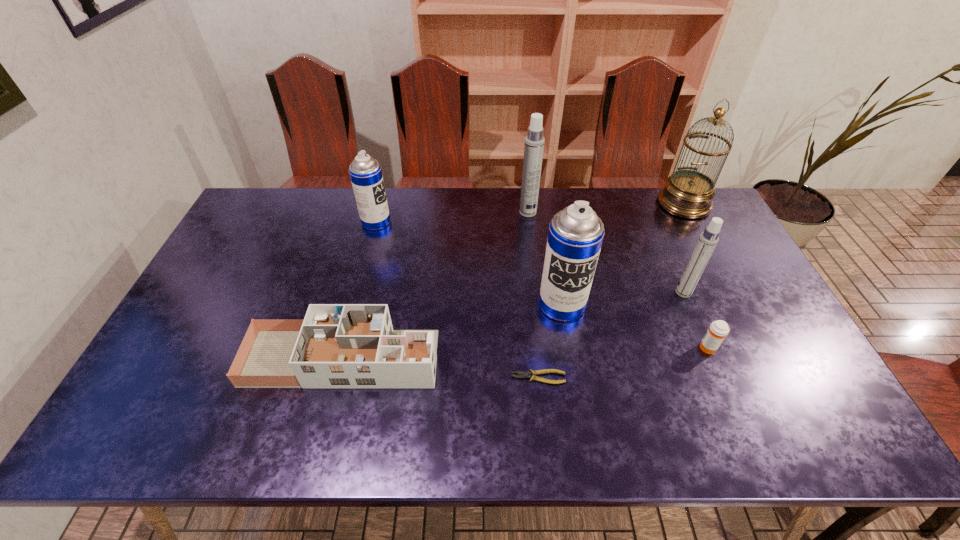
At what (x,y) coordinates should I click in order to perform the action: click on golden birdcage. Please return your answer as a coordinate pair (x, y). The width and height of the screenshot is (960, 540). Looking at the image, I should click on (687, 193).

Identify the location of birdcage. (687, 193).

Identify the location of the bigger white aerosol can. This screenshot has width=960, height=540. (534, 141).

Where is `the left white aerosol can`? The height and width of the screenshot is (540, 960). the left white aerosol can is located at coordinates (534, 141).

What are the coordinates of `the right blue aerosol can` in the screenshot? It's located at (576, 233).

Where is `the bigger blue aerosol can`? the bigger blue aerosol can is located at coordinates (576, 233).

Where is `the smaller white aerosol can`? This screenshot has width=960, height=540. the smaller white aerosol can is located at coordinates (708, 239).

You are a GUI agent. You are given a task and a screenshot of the screen. Output one action in this format:
    pyautogui.click(x=<x>, y=<y>)
    Task: Click on the rightmost aerosol can
    This screenshot has height=540, width=960.
    Given the screenshot: What is the action you would take?
    pyautogui.click(x=708, y=239)

Locate an element on the screen. The width and height of the screenshot is (960, 540). the leftmost aerosol can is located at coordinates (365, 172).

I want to click on the farther blue aerosol can, so click(x=365, y=172).